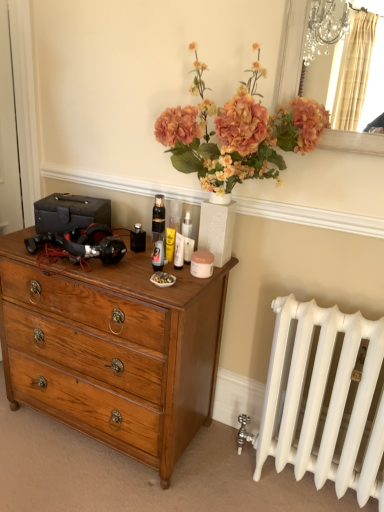
Question: Is wooden chest of drawers at left thinner than silver/metallic mirror at upper right?

Choices:
 (A) yes
 (B) no

Answer: (B)

Question: Are wooden chest of drawers at left and silver/metallic mirror at upper right far apart?

Choices:
 (A) no
 (B) yes

Answer: (B)

Question: Does wooden chest of drawers at left come behind silver/metallic mirror at upper right?

Choices:
 (A) yes
 (B) no

Answer: (A)

Question: Considering the relative positions of wooden chest of drawers at left and silver/metallic mirror at upper right in the image provided, is wooden chest of drawers at left to the left of silver/metallic mirror at upper right from the viewer's perspective?

Choices:
 (A) yes
 (B) no

Answer: (A)

Question: Considering the relative sizes of wooden chest of drawers at left and silver/metallic mirror at upper right in the image provided, is wooden chest of drawers at left shorter than silver/metallic mirror at upper right?

Choices:
 (A) yes
 (B) no

Answer: (B)

Question: Would you say wooden chest of drawers at left contains silver/metallic mirror at upper right?

Choices:
 (A) yes
 (B) no

Answer: (B)

Question: Is white glossy lotion at center behind wooden chest of drawers at left?

Choices:
 (A) yes
 (B) no

Answer: (A)

Question: Is white glossy lotion at center facing away from wooden chest of drawers at left?

Choices:
 (A) no
 (B) yes

Answer: (A)

Question: From a real-world perspective, does white glossy lotion at center sit lower than wooden chest of drawers at left?

Choices:
 (A) no
 (B) yes

Answer: (A)

Question: Are white glossy lotion at center and wooden chest of drawers at left beside each other?

Choices:
 (A) no
 (B) yes

Answer: (A)

Question: Can you confirm if white glossy lotion at center is thinner than wooden chest of drawers at left?

Choices:
 (A) yes
 (B) no

Answer: (A)

Question: Does white glossy lotion at center come in front of wooden chest of drawers at left?

Choices:
 (A) no
 (B) yes

Answer: (A)

Question: Considering the relative sizes of white glossy lotion at center and silver/metallic mirror at upper right in the image provided, is white glossy lotion at center taller than silver/metallic mirror at upper right?

Choices:
 (A) no
 (B) yes

Answer: (A)